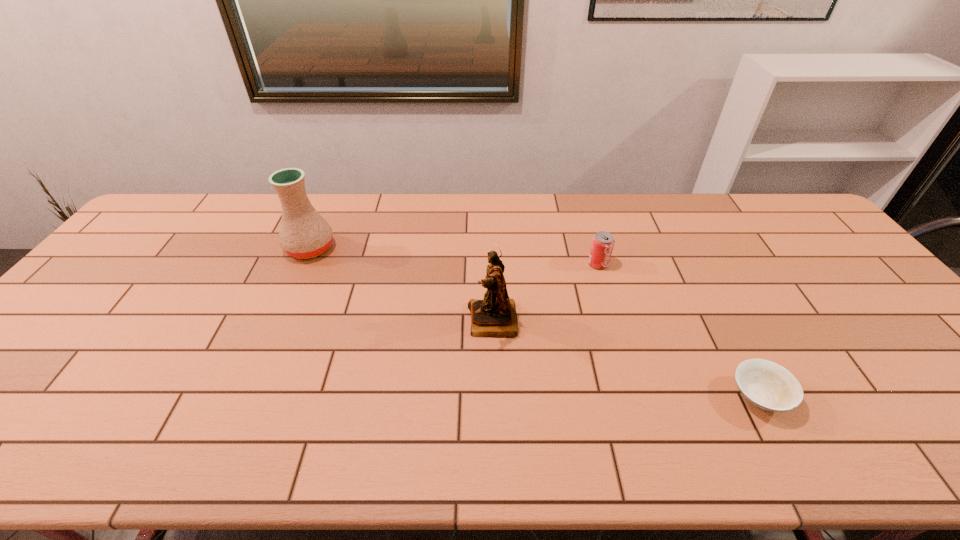
Find the location of `the leftmost object`. the leftmost object is located at coordinates (x=304, y=233).

Find the location of a particular element. This screenshot has width=960, height=540. the third object from right to left is located at coordinates (495, 316).

Where is `figurine`? The height and width of the screenshot is (540, 960). figurine is located at coordinates (495, 316).

Find the location of a particular element. The height and width of the screenshot is (540, 960). soda can is located at coordinates (603, 242).

Where is `the third tallest object`? The image size is (960, 540). the third tallest object is located at coordinates (603, 242).

Locate an element on the screen. the nearest object is located at coordinates (767, 385).

I want to click on the rightmost object, so click(x=767, y=385).

Where is `free spot located 0.100m on the front of the pottery`? free spot located 0.100m on the front of the pottery is located at coordinates (293, 288).

Locate an element on the screen. This screenshot has height=540, width=960. blank space located on the front-facing side of the third object from right to left is located at coordinates (433, 321).

Locate an element on the screen. Image resolution: width=960 pixels, height=540 pixels. free space located on the front-facing side of the third object from right to left is located at coordinates (361, 321).